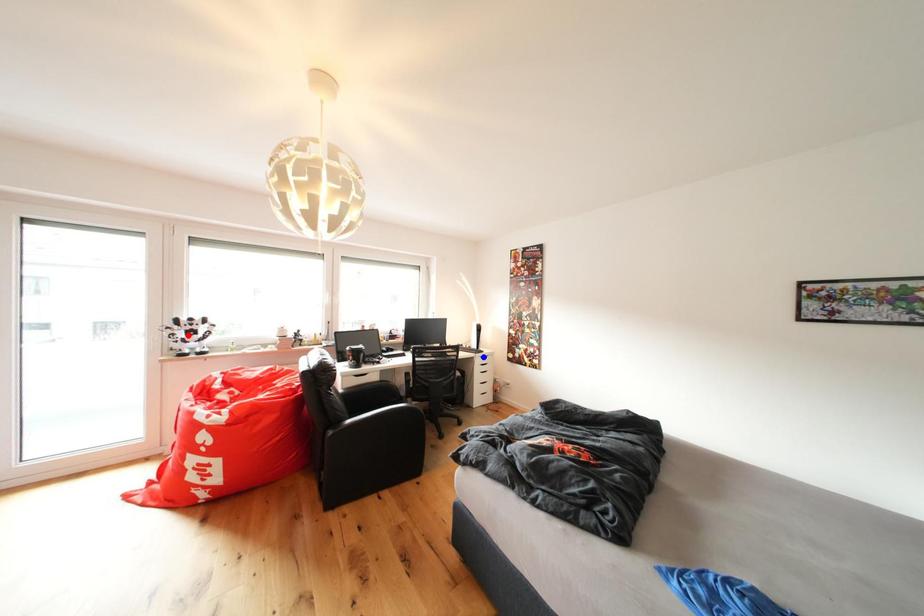
Question: Two points are marked on the image. Which point is closer to the camera?

Choices:
 (A) Blue point is closer.
 (B) Red point is closer.

Answer: (B)